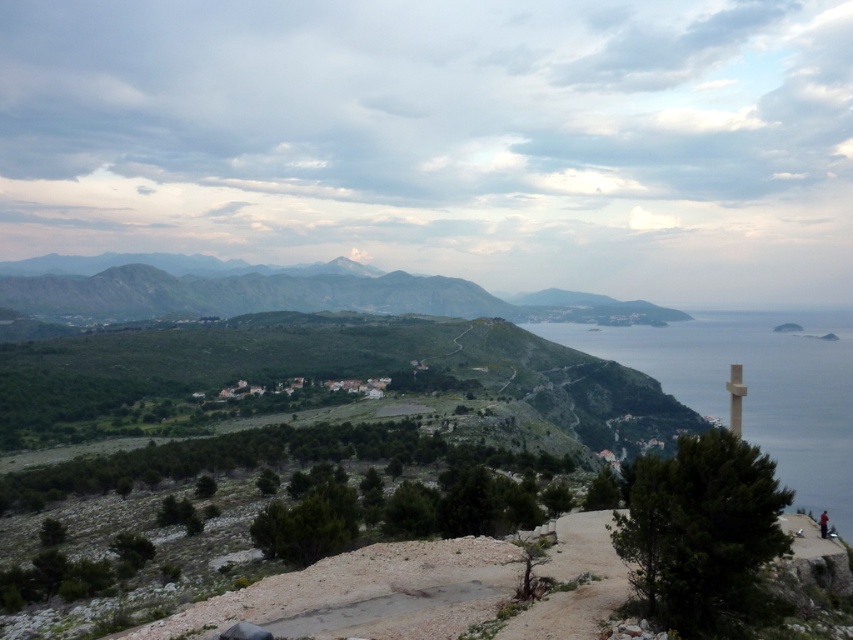
Question: Can you confirm if blue water at right is smaller than dark red fabric at lower right?

Choices:
 (A) no
 (B) yes

Answer: (A)

Question: Which is farther from the blue water at right?

Choices:
 (A) dark red fabric at lower right
 (B) green grassy hill at left

Answer: (A)

Question: Based on their relative distances, which object is farther from the dark red fabric at lower right?

Choices:
 (A) blue water at right
 (B) green grassy hill at left

Answer: (B)

Question: Is the position of blue water at right less distant than that of green grassy hill at left?

Choices:
 (A) yes
 (B) no

Answer: (A)

Question: Among these objects, which one is farthest from the camera?

Choices:
 (A) green grassy hill at left
 (B) blue water at right

Answer: (A)

Question: Is blue water at right positioned at the back of green grassy hill at left?

Choices:
 (A) yes
 (B) no

Answer: (B)